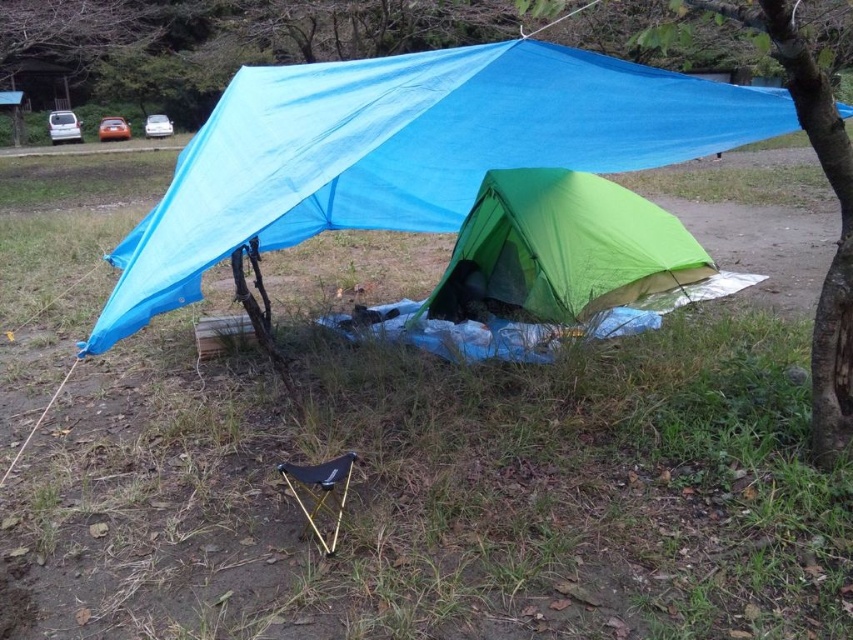
Question: Does blue tarp at upper center have a larger size compared to green fabric tent at center?

Choices:
 (A) yes
 (B) no

Answer: (A)

Question: Does blue tarp at upper center appear over green fabric tent at lower right?

Choices:
 (A) no
 (B) yes

Answer: (B)

Question: Which object is the farthest from the green fabric tent at center?

Choices:
 (A) blue tarp at upper center
 (B) green fabric tent at lower right

Answer: (B)

Question: Which point appears closest to the camera in this image?

Choices:
 (A) (831, 264)
 (B) (370, 77)

Answer: (B)

Question: Which object is the closest to the green fabric tent at center?

Choices:
 (A) green fabric tent at lower right
 (B) blue tarp at upper center

Answer: (B)

Question: Is blue tarp at upper center further to the viewer compared to green fabric tent at center?

Choices:
 (A) yes
 (B) no

Answer: (B)